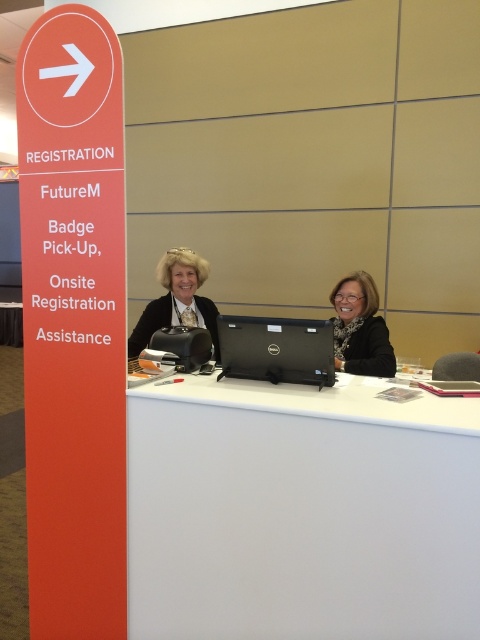
Which is below, black matte laptop at center or matte black laptop at center?

Positioned lower is black matte laptop at center.

Is point (330, 323) farther from viewer compared to point (159, 300)?

That is False.

Does point (263, 340) come behind point (168, 257)?

No.

Find the location of `black matte laptop at center`. black matte laptop at center is located at coordinates (276, 349).

Does white plastic desk at center have a lesser width compared to matte black laptop at center?

No, white plastic desk at center is not thinner than matte black laptop at center.

Measure the distance between white plastic desk at center and matte black laptop at center.

The distance of white plastic desk at center from matte black laptop at center is 1.06 meters.

Does point (396, 486) come behind point (193, 294)?

No, it is not.

Where is `white plastic desk at center`? The height and width of the screenshot is (640, 480). white plastic desk at center is located at coordinates (300, 513).

Is white plastic desk at center positioned at the back of black matte laptop at center?

That is False.

Is white plastic desk at center thinner than black matte laptop at center?

Incorrect, white plastic desk at center's width is not less than black matte laptop at center's.

This screenshot has width=480, height=640. Find the location of `white plastic desk at center`. white plastic desk at center is located at coordinates (300, 513).